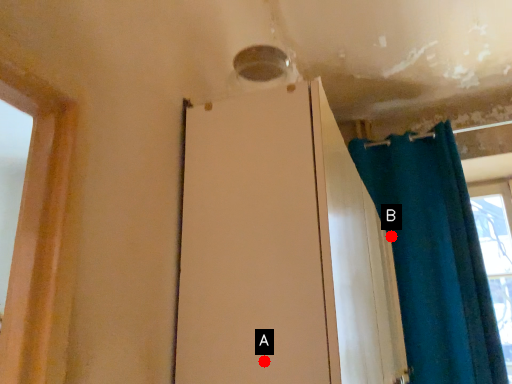
Question: Two points are circled on the image, labeled by A and B beside each circle. Which point appears farthest from the camera in this image?

Choices:
 (A) A is further
 (B) B is further

Answer: (B)